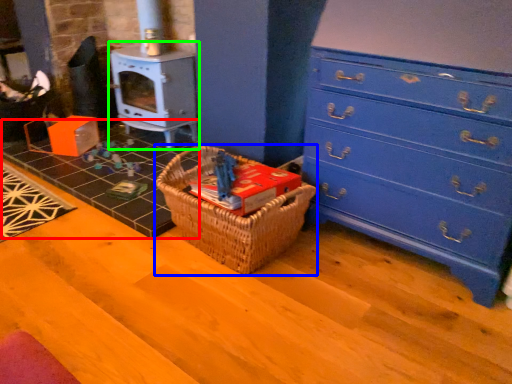
Question: Considering the real-world distances, which object is farthest from tile (highlighted by a red box)? picnic basket (highlighted by a blue box) or appliance (highlighted by a green box)?

Choices:
 (A) picnic basket
 (B) appliance

Answer: (A)